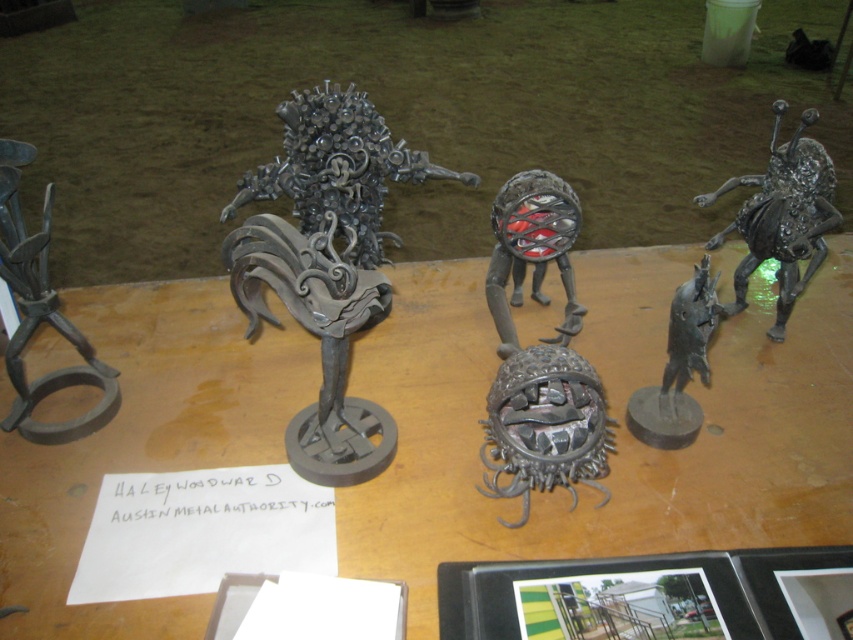
Question: Does metallic gray sculpture at center come behind matte black horse at right?

Choices:
 (A) yes
 (B) no

Answer: (B)

Question: Does metallic gray sculpture at center lie in front of dark gray metal/iron at left?

Choices:
 (A) yes
 (B) no

Answer: (A)

Question: Which point is farther to the camera?

Choices:
 (A) metallic gray sculpture at center
 (B) dark gray metal/iron at left
 (C) shiny metallic bug at right

Answer: (C)

Question: Does metallic gray sculpture at center appear on the left side of matte black metal sphere at center?

Choices:
 (A) yes
 (B) no

Answer: (B)

Question: Which point is farther to the camera?

Choices:
 (A) dark gray metal/iron at left
 (B) metallic sculpture at center
 (C) shiny metallic bug at right
 (D) matte black metal sphere at center

Answer: (C)

Question: Which point is closer to the camera taking this photo?

Choices:
 (A) click(x=668, y=321)
 (B) click(x=91, y=410)

Answer: (A)